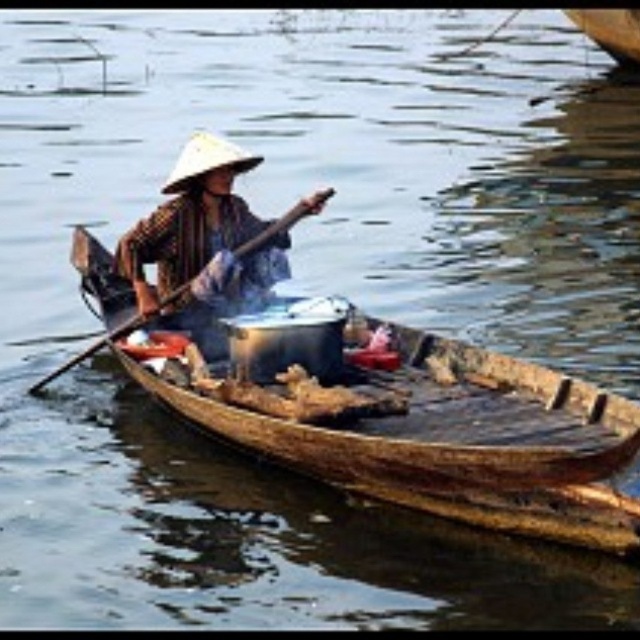
You are a tourist on a boat trip and see the wooden paddle at center and the wooden boat at upper right. Which object is located to the left of the other?

The wooden paddle at center is positioned on the left side of wooden boat at upper right.

You are a tourist on a boat trip and want to take a photo of the brown woven hat at center and the wooden paddle at center. Which object should you focus on first if you want to capture both in the same frame without moving the camera?

The brown woven hat at center is much taller than the wooden paddle at center, so you should focus on the brown woven hat at center first to ensure it fits within the frame.